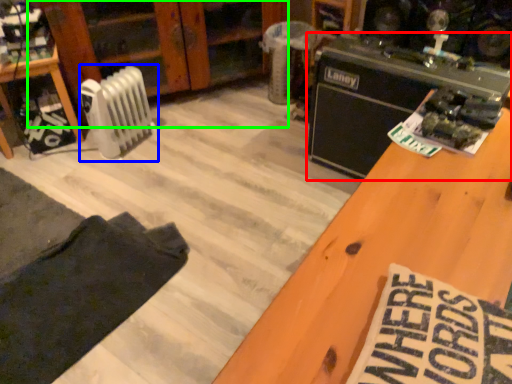
Question: Considering the real-world distances, which object is closest to appliance (highlighted by a red box)? radiator (highlighted by a blue box) or dresser (highlighted by a green box).

Choices:
 (A) radiator
 (B) dresser

Answer: (B)